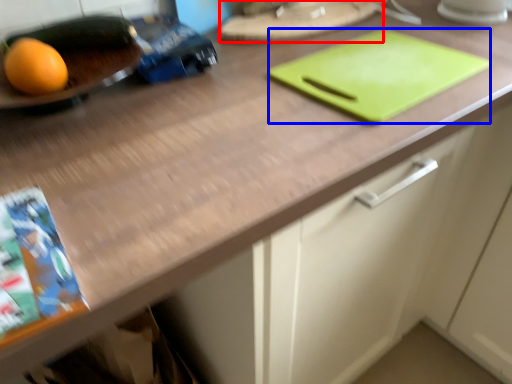
Question: Which point is closer to the camera, tray (highlighted by a red box) or tray (highlighted by a blue box)?

Choices:
 (A) tray
 (B) tray

Answer: (B)